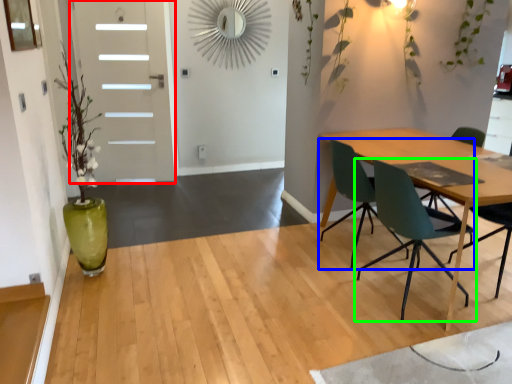
Question: Which is nearer to the door (highlighted by a red box)? chair (highlighted by a blue box) or chair (highlighted by a green box).

Choices:
 (A) chair
 (B) chair

Answer: (A)